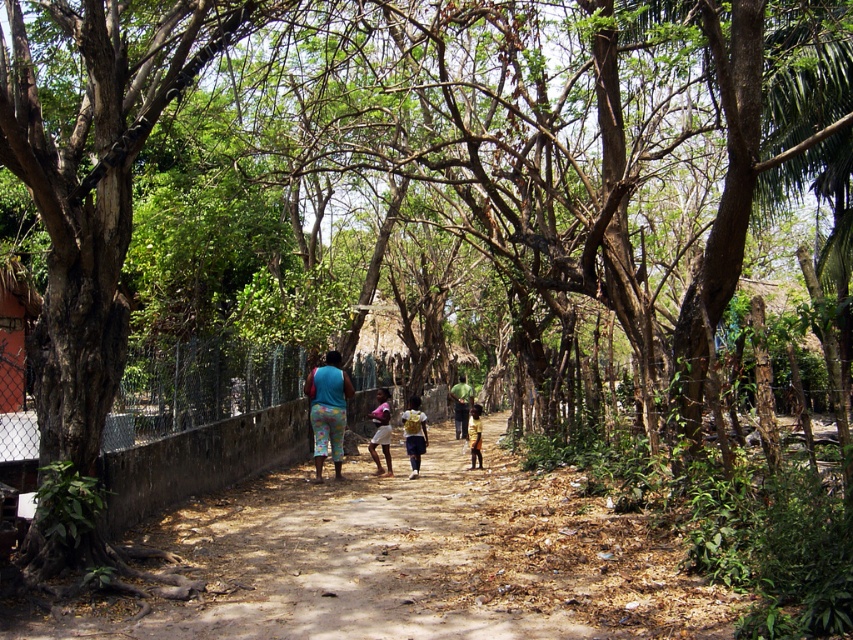
Question: Can you confirm if dark green fabric at center is positioned to the left of yellow fabric child at center?

Choices:
 (A) yes
 (B) no

Answer: (B)

Question: Among these points, which one is farthest from the camera?

Choices:
 (A) (321, 388)
 (B) (219, 360)
 (C) (412, 420)
 (D) (471, 406)

Answer: (D)

Question: Is chain-link fence at center in front of yellow fabric backpack at center?

Choices:
 (A) no
 (B) yes

Answer: (B)

Question: Which point is closer to the camera?

Choices:
 (A) yellow fabric backpack at center
 (B) multicolored fabric pants at center
 (C) dark green fabric at center
 (D) yellow fabric child at center

Answer: (B)

Question: In this image, where is chain-link fence at center located relative to yellow fabric child at center?

Choices:
 (A) left
 (B) right

Answer: (A)

Question: Which object is the farthest from the multicolored fabric pants at center?

Choices:
 (A) dark green fabric at center
 (B) pink fabric dress at center
 (C) yellow fabric backpack at center

Answer: (A)